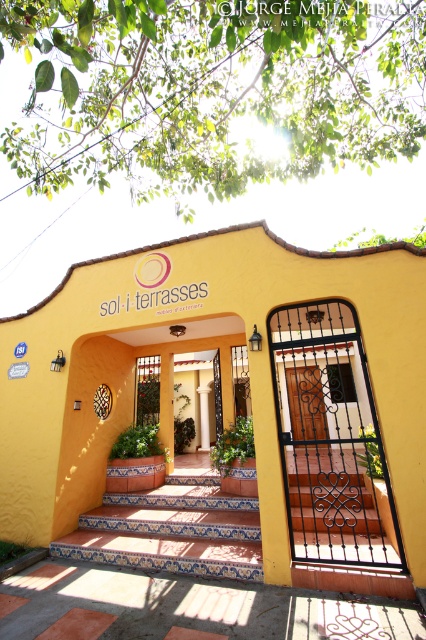
Question: Observing the image, what is the correct spatial positioning of blue tile stairs at center in reference to wooden door at center?

Choices:
 (A) right
 (B) left

Answer: (B)

Question: Does blue tile stairs at center have a smaller size compared to wooden door at center?

Choices:
 (A) yes
 (B) no

Answer: (B)

Question: Can you confirm if blue tile stairs at center is positioned to the right of wooden door at center?

Choices:
 (A) no
 (B) yes

Answer: (A)